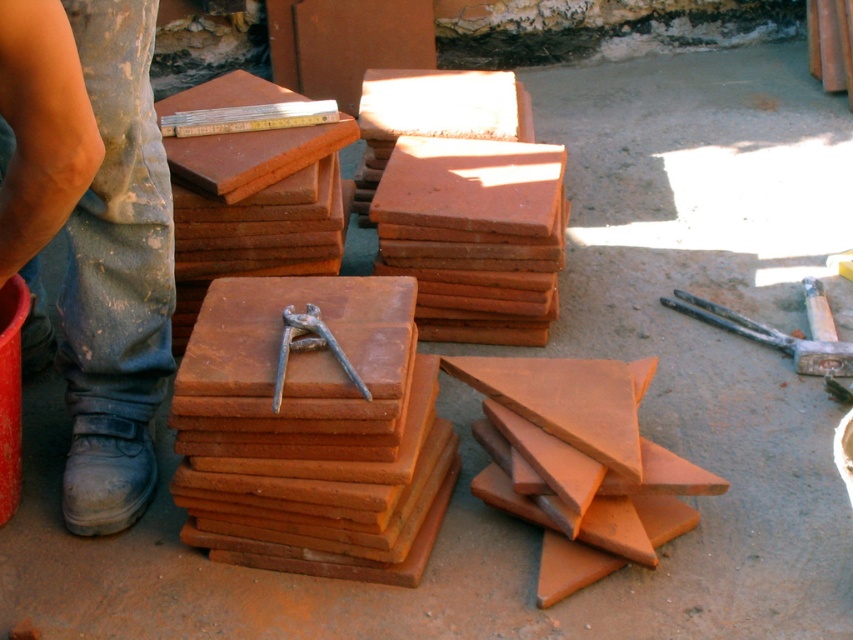
You are a worker in the construction site. You need to move the blue jeans at lower left to the nearest stack of terracotta tiles. Which direction should you move it to?

The blue jeans at lower left is located at point (90,234). The nearest stack would be the one closest to this coordinate, so move it towards the closest stack in that direction.

You are a worker in the construction site and you want to move a heavy object from the blue jeans at lower left to the terracotta clay tiles at lower right. Which object will require more space horizontally to move?

The terracotta clay tiles at lower right require more space horizontally because they have a greater width than the blue jeans at lower left.

You are a worker in a construction site and you need to place both the rusty metal hammer at lower right and the rusty metal pliers at center into a tool box. The tool box has a width of 15 cm. Can you fit both tools side by side in the tool box?

The rusty metal hammer at lower right might be wider than rusty metal pliers at center. Since the tool box is only 15 cm wide, it is uncertain whether both can fit side by side without overlapping. The hammer might exceed the width limit, making it difficult to fit both.